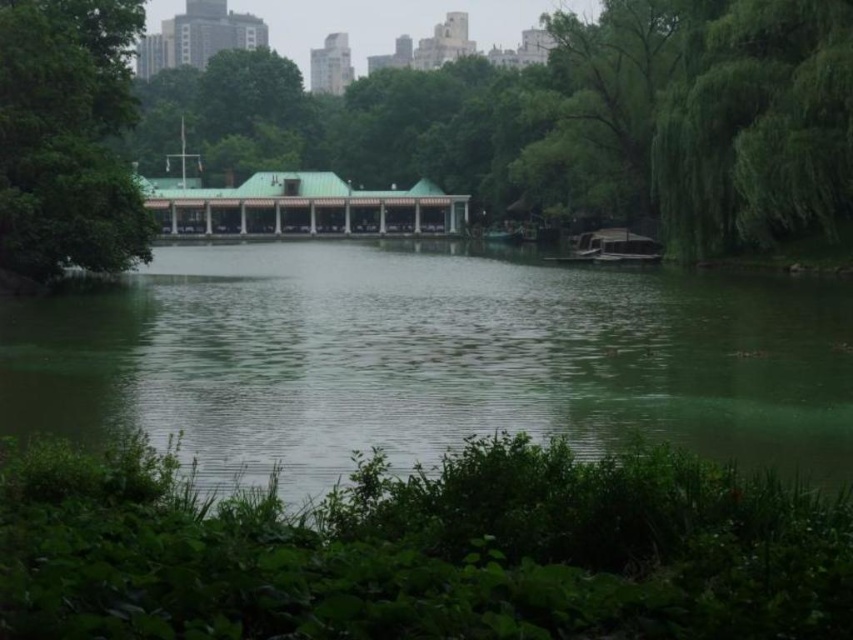
Question: Which of these objects is positioned farthest from the green leafy tree at upper right?

Choices:
 (A) green leafy tree at left
 (B) green leafy tree at center
 (C) green smooth water at center

Answer: (A)

Question: From the image, what is the correct spatial relationship of green smooth water at center in relation to green leafy tree at center?

Choices:
 (A) right
 (B) left

Answer: (A)

Question: Observing the image, what is the correct spatial positioning of green leafy tree at center in reference to green leafy tree at left?

Choices:
 (A) above
 (B) below

Answer: (A)

Question: Among these points, which one is farthest from the camera?

Choices:
 (A) (685, 17)
 (B) (677, 108)

Answer: (A)

Question: Among these points, which one is farthest from the camera?

Choices:
 (A) (96, 148)
 (B) (639, 112)
 (C) (822, 97)
 (D) (320, 328)

Answer: (B)

Question: Can you confirm if green leafy tree at center is bigger than green leafy tree at upper right?

Choices:
 (A) yes
 (B) no

Answer: (A)